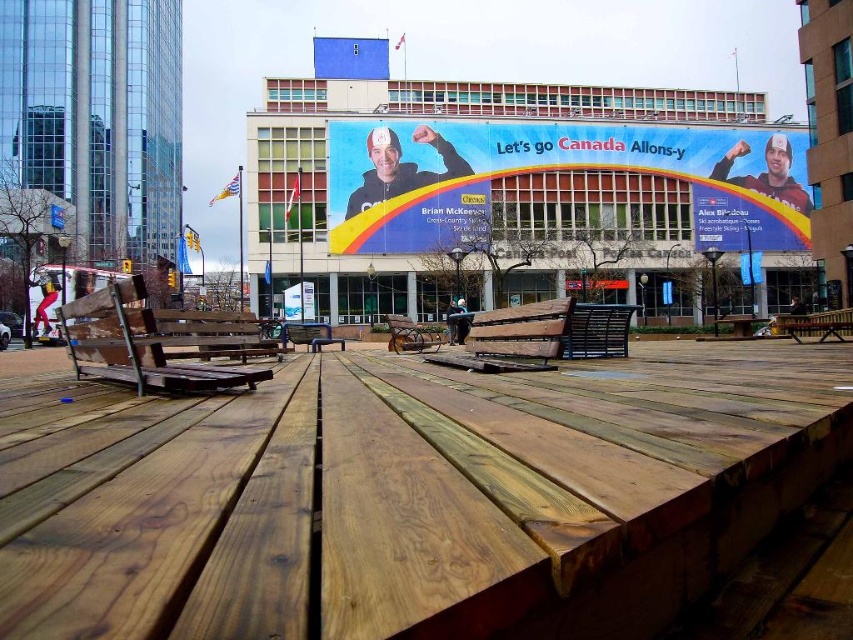
Question: Considering the relative positions of natural wood park bench at left and wooden bench at center in the image provided, where is natural wood park bench at left located with respect to wooden bench at center?

Choices:
 (A) right
 (B) left

Answer: (B)

Question: Based on their relative distances, which object is farther from the dark brown wood park bench at center?

Choices:
 (A) matte blue banner at center
 (B) natural wood park bench at left
 (C) wooden bench at center

Answer: (A)

Question: Which is nearer to the wooden park bench at center?

Choices:
 (A) dark brown wood park bench at center
 (B) wooden bench at center
 (C) natural wood park bench at left
 (D) brown wooden picnic table at center

Answer: (A)

Question: Which object appears closest to the camera in this image?

Choices:
 (A) dark brown wood park bench at center
 (B) wooden park bench at center
 (C) wooden bench at center

Answer: (A)

Question: Can you confirm if natural wood park bench at left is smaller than natural wood park bench at center?

Choices:
 (A) no
 (B) yes

Answer: (B)

Question: Can you confirm if natural wood park bench at left is wider than wooden bench at center?

Choices:
 (A) no
 (B) yes

Answer: (A)